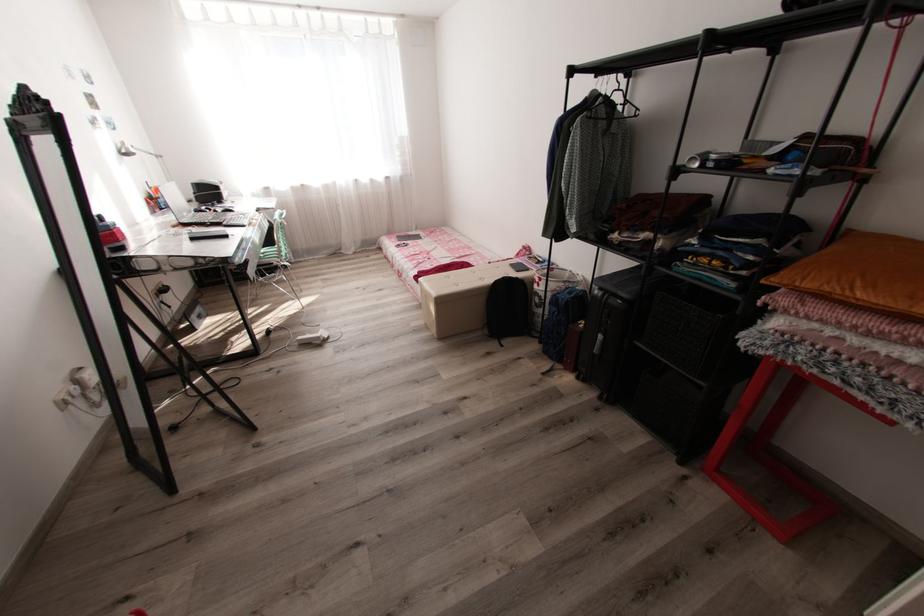
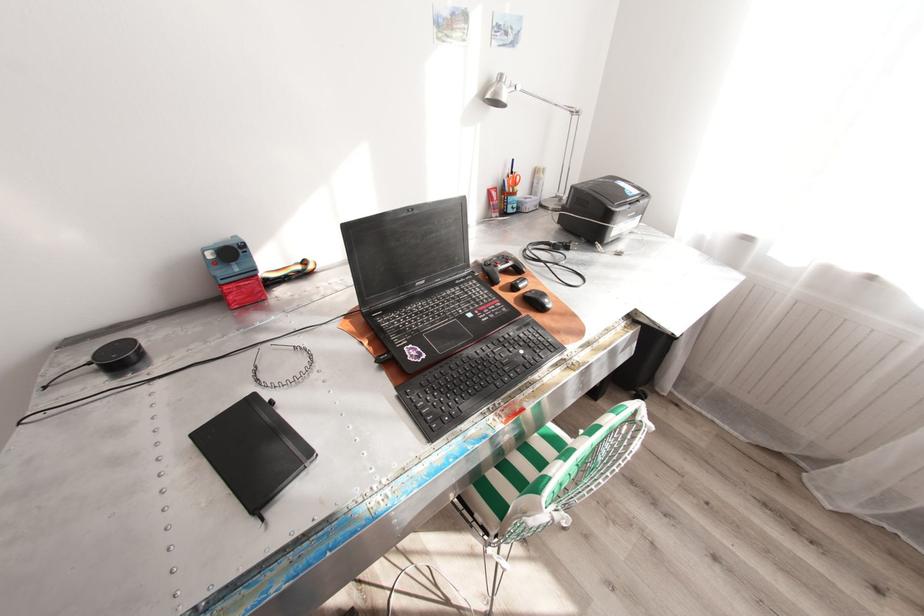
The point at (128, 143) is marked in the first image. Where is the corresponding point in the second image?

(505, 76)